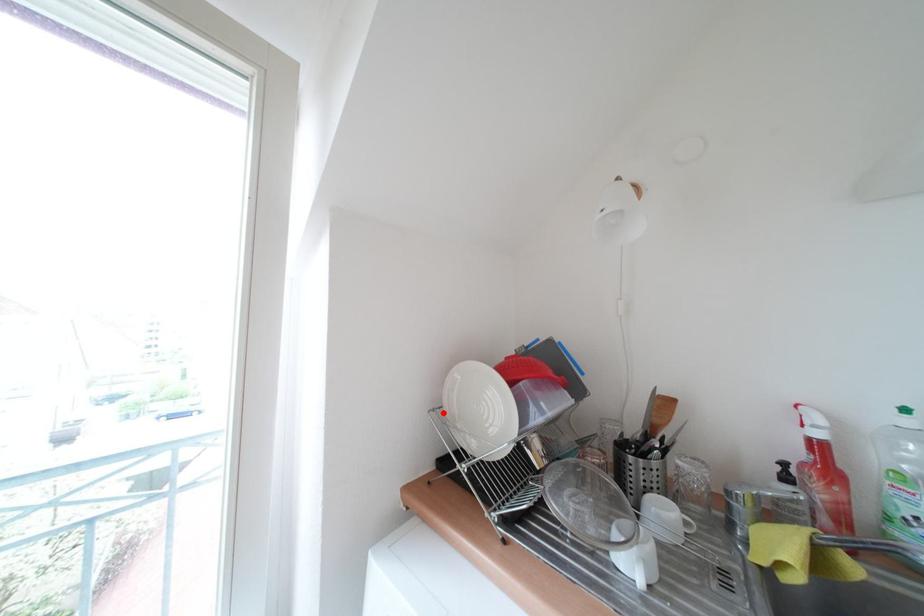
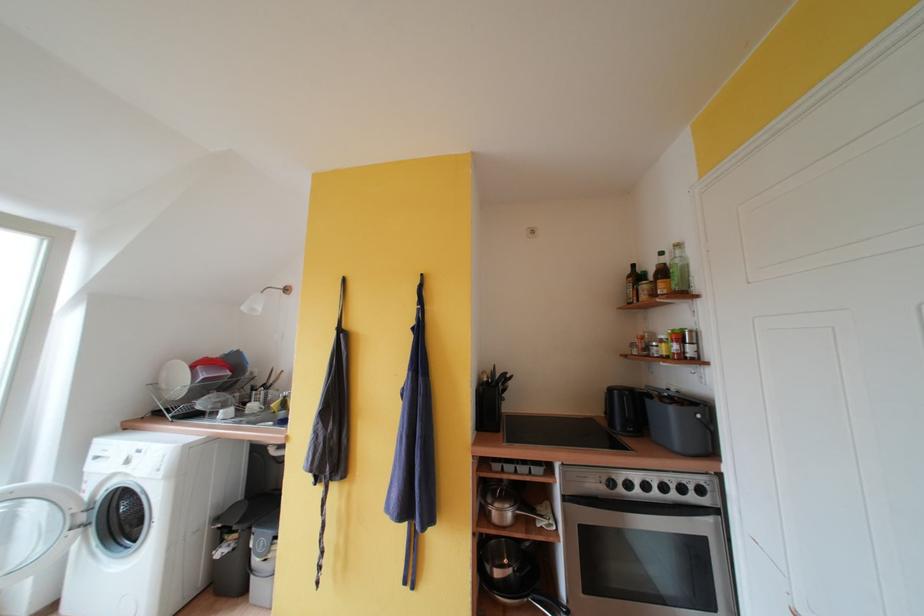
The point at the highlighted location is marked in the first image. Where is the corresponding point in the second image?

(160, 387)